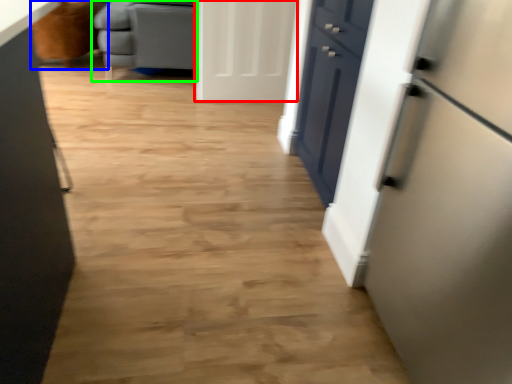
Question: Based on their relative distances, which object is nearer to door (highlighted by a red box)? Choose from armchair (highlighted by a blue box) and furniture (highlighted by a green box).

Choices:
 (A) armchair
 (B) furniture

Answer: (B)